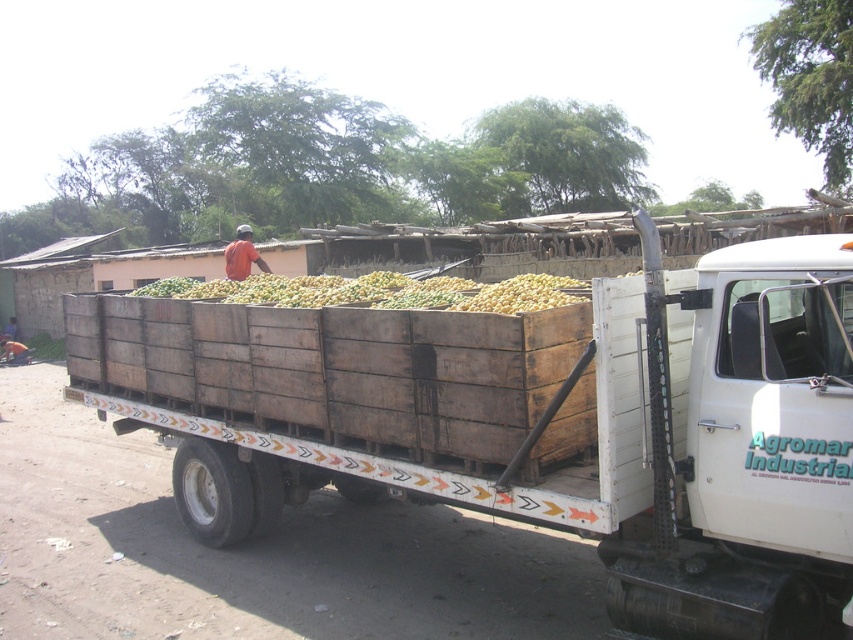
Question: Where is wooden crates at center located in relation to yellow matte produce at center in the image?

Choices:
 (A) above
 (B) below

Answer: (B)

Question: Among these objects, which one is nearest to the camera?

Choices:
 (A) yellow matte produce at center
 (B) wooden crates at center

Answer: (B)

Question: Which point is farther to the camera?

Choices:
 (A) (311, 369)
 (B) (308, 292)

Answer: (B)

Question: Does wooden crates at center lie in front of yellow matte produce at center?

Choices:
 (A) no
 (B) yes

Answer: (B)

Question: Is wooden crates at center positioned before yellow matte produce at center?

Choices:
 (A) no
 (B) yes

Answer: (B)

Question: Which object is closer to the camera taking this photo?

Choices:
 (A) wooden crates at center
 (B) yellow matte produce at center

Answer: (A)